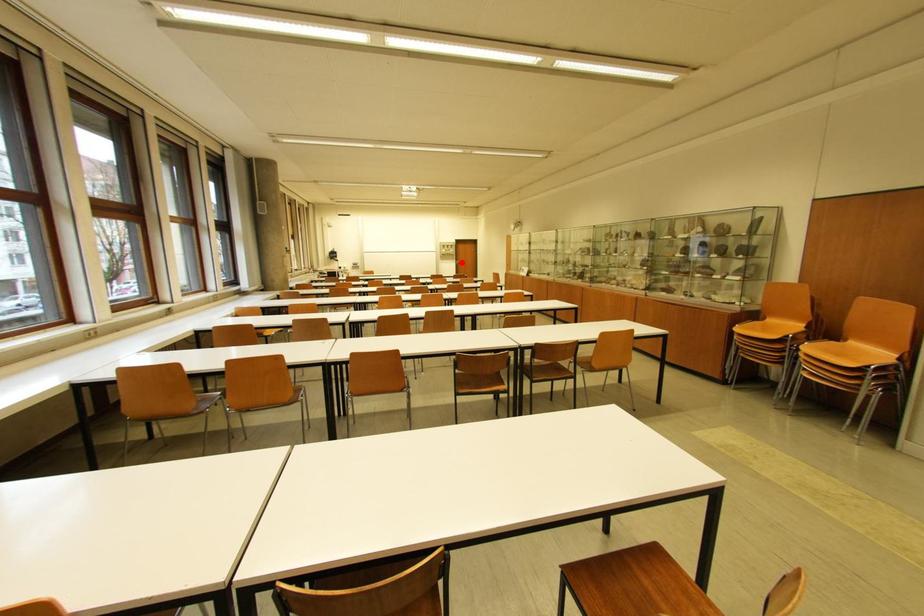
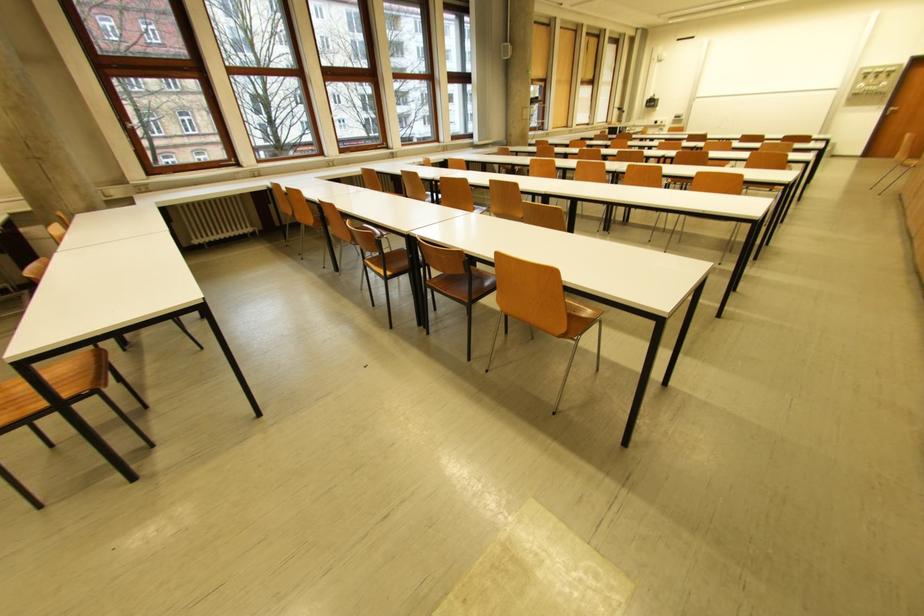
Question: A red point is marked in image1. In image2, is the corresponding 3D point closer to the camera or farther? Reply with the corresponding letter.

Choices:
 (A) The corresponding 3D point is closer.
 (B) The corresponding 3D point is farther.

Answer: (B)